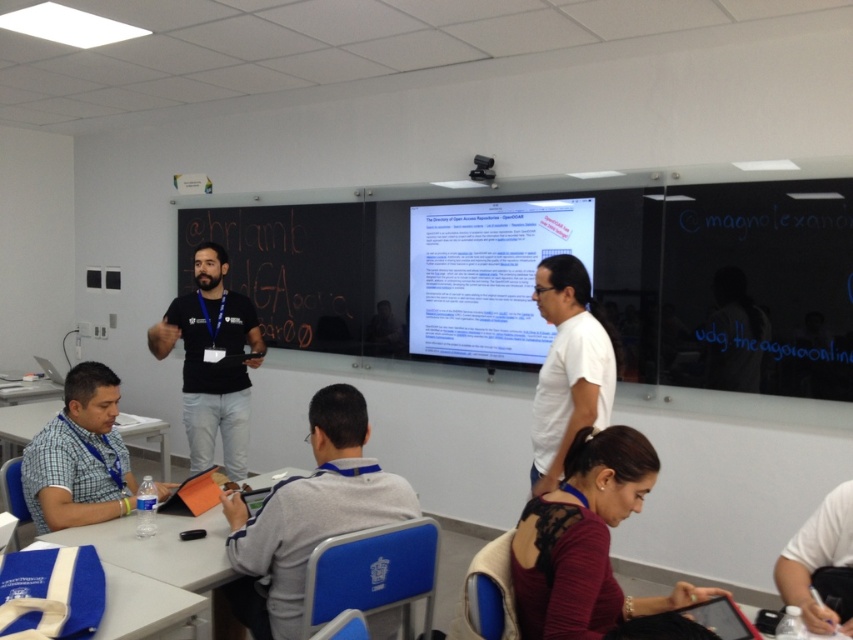
Question: Which of the following is the farthest from the observer?

Choices:
 (A) (258, 262)
 (B) (219, 346)

Answer: (A)

Question: Which of the following is the farthest from the observer?

Choices:
 (A) (445, 288)
 (B) (178, 538)
 (C) (61, 417)
 (D) (218, 259)

Answer: (A)

Question: Is white paper at center positioned before blue fabric bag at lower left?

Choices:
 (A) no
 (B) yes

Answer: (A)

Question: Does gray fleece jacket at center have a smaller size compared to black chalkboard at center?

Choices:
 (A) no
 (B) yes

Answer: (B)

Question: Which of the following is the closest to the observer?

Choices:
 (A) (100, 368)
 (B) (525, 538)
 (C) (239, 221)

Answer: (B)

Question: Does gray fleece jacket at center appear on the right side of white plastic table at lower left?

Choices:
 (A) no
 (B) yes

Answer: (B)